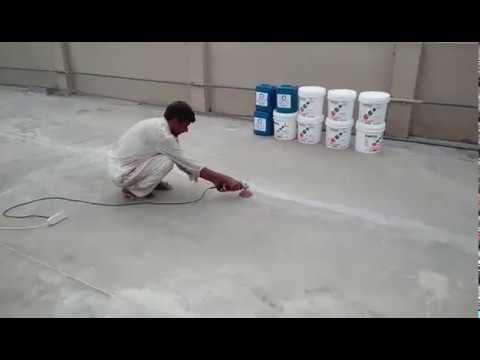
Find the location of a particular element. cable is located at coordinates (175, 202).